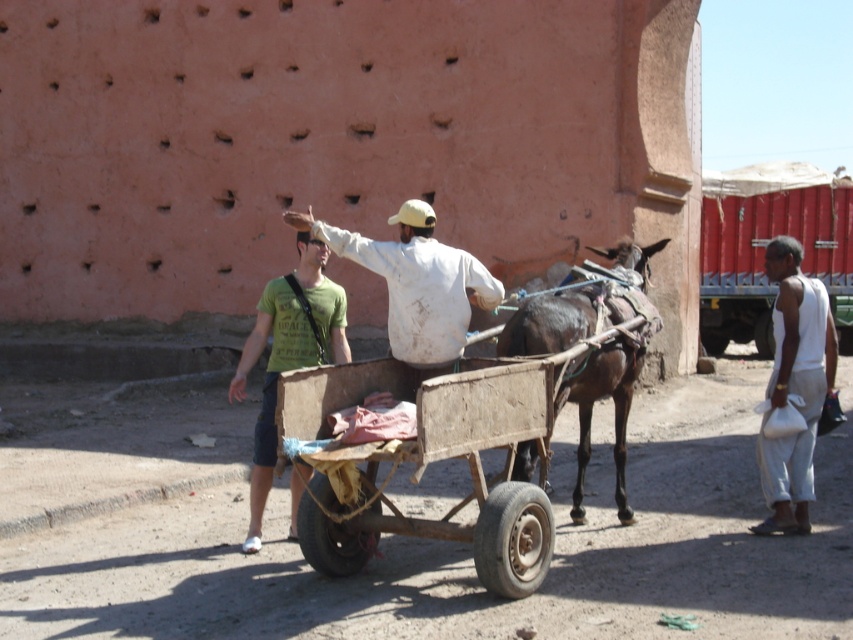
Question: Does white cotton bag at lower right have a smaller size compared to green t-shirt at center?

Choices:
 (A) no
 (B) yes

Answer: (A)

Question: Does wooden cart at center appear on the left side of brown leather mule at center?

Choices:
 (A) yes
 (B) no

Answer: (A)

Question: Estimate the real-world distances between objects in this image. Which object is farther from the brown leather mule at center?

Choices:
 (A) wooden cart at center
 (B) white cotton bag at lower right
 (C) dirty white shirt at center
 (D) green t-shirt at center

Answer: (D)

Question: Does white cotton bag at lower right appear on the right side of green t-shirt at center?

Choices:
 (A) yes
 (B) no

Answer: (A)

Question: Which is farther from the brown leather mule at center?

Choices:
 (A) dirty white shirt at center
 (B) green t-shirt at center
 (C) white cotton bag at lower right

Answer: (B)

Question: Which is nearer to the dirty white shirt at center?

Choices:
 (A) brown leather mule at center
 (B) green t-shirt at center

Answer: (B)